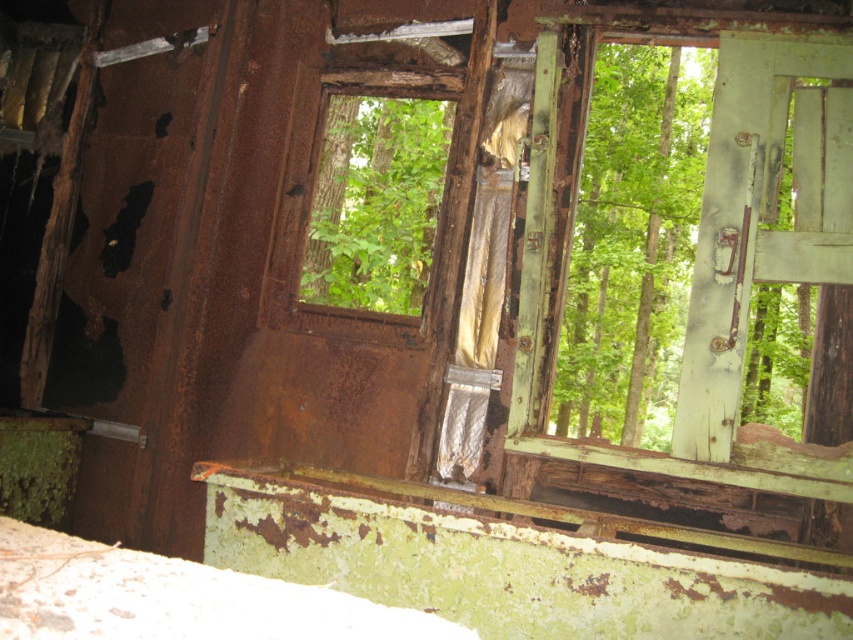
Question: Which point is farther to the camera?

Choices:
 (A) (480, 13)
 (B) (587, 272)

Answer: (B)

Question: Does rusty wood window at center appear under green leafy tree at center?

Choices:
 (A) no
 (B) yes

Answer: (B)

Question: Does rusty wood window at center appear over green leafy tree at center?

Choices:
 (A) no
 (B) yes

Answer: (A)

Question: Is rusty wood window at center smaller than green leafy tree at center?

Choices:
 (A) no
 (B) yes

Answer: (B)